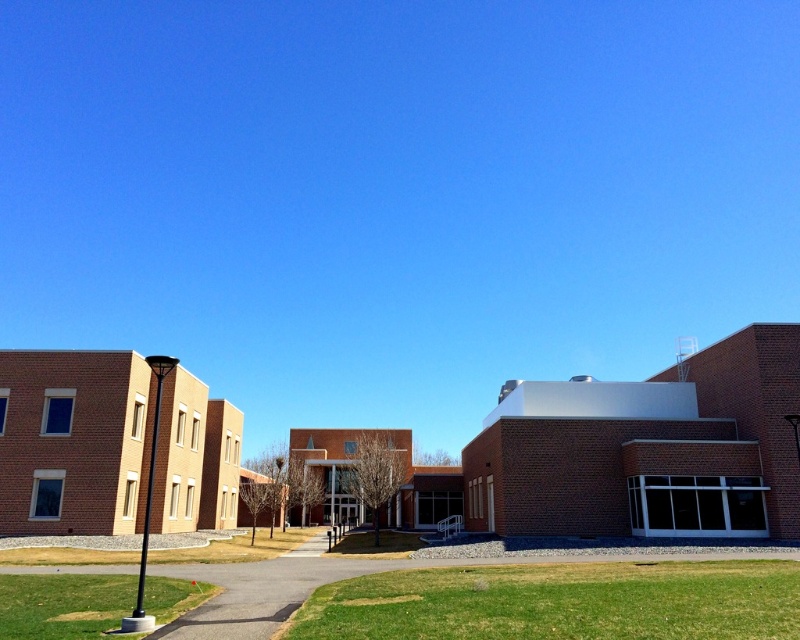
You are standing at the entrance of the grassy area and want to reach the point marked at coordinates point (202, 428). Given that the pathway curves gently through the grass, can you estimate how far you need to walk to reach that point?

The point (202, 428) is 116.84 feet away from the viewer, so you need to walk approximately 116.84 feet to reach it.

You are standing at the entrance of the grassy area and want to reach the brick building at center. According to the map coordinates provided, where should you head towards?

The brick building at center is located at point (608, 452), so you should head towards that coordinate to reach it.